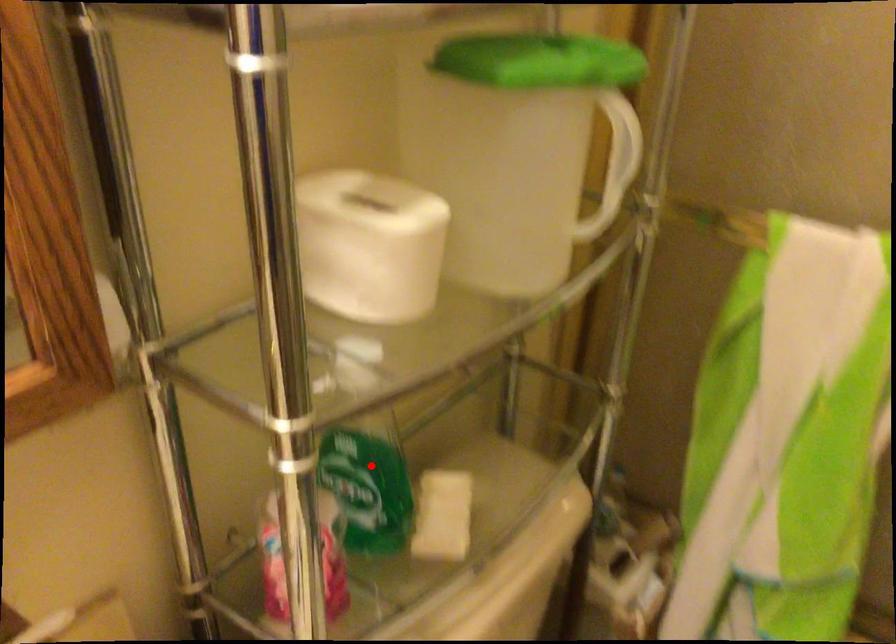
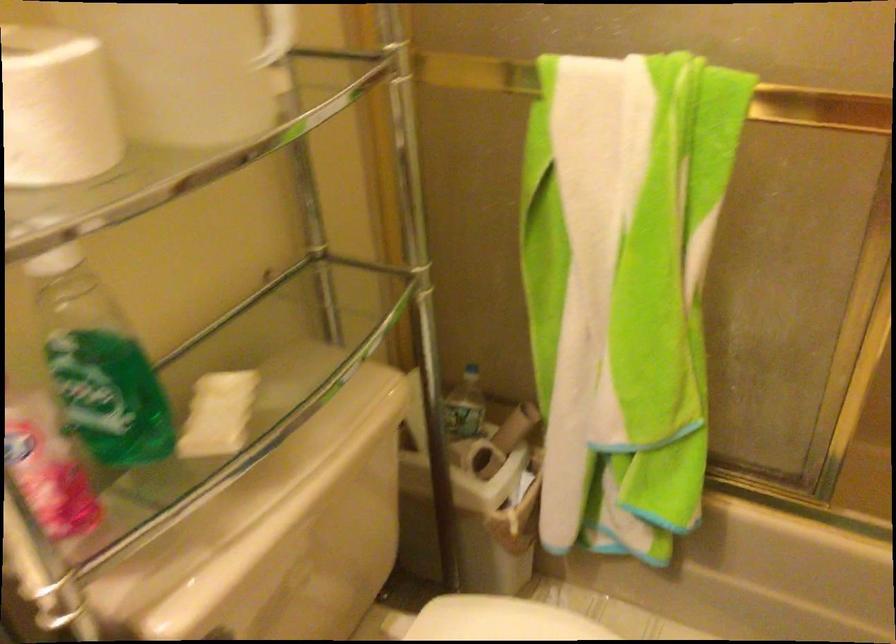
Question: I am providing you with two images of the same scene from different viewpoints. Image1 has a red point marked. In image2, the corresponding 3D location appears at what relative position? Reply with the corresponding letter.

Choices:
 (A) Closer
 (B) Farther

Answer: (A)